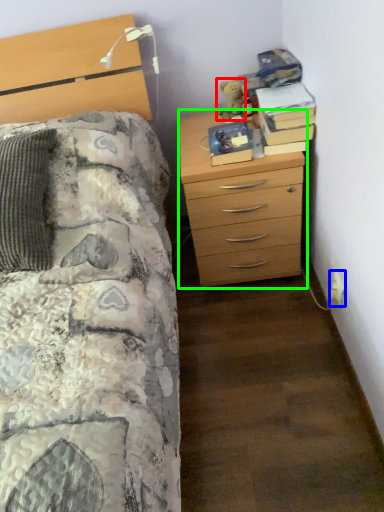
Question: Estimate the real-world distances between objects in this image. Which object is closer to teddy (highlighted by a red box), electric outlet (highlighted by a blue box) or chest of drawers (highlighted by a green box)?

Choices:
 (A) electric outlet
 (B) chest of drawers

Answer: (B)